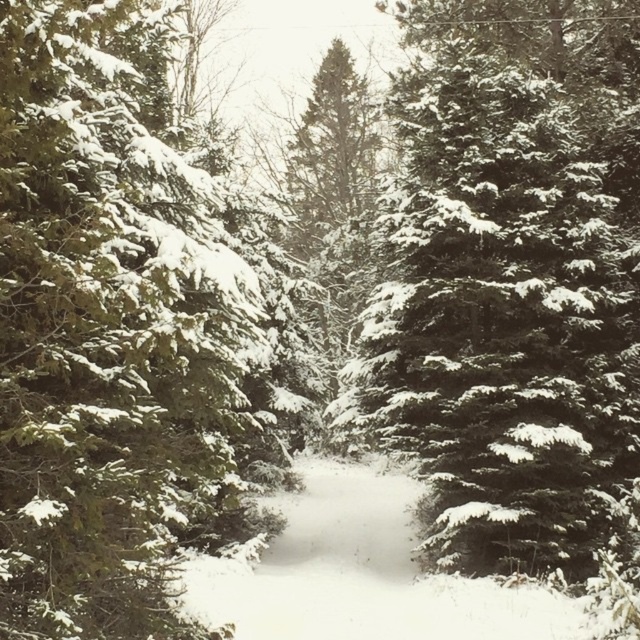
Question: Which of the following is the farthest from the observer?

Choices:
 (A) snow-covered evergreen at center
 (B) green matte evergreen tree at left

Answer: (A)

Question: Is green matte evergreen tree at left to the right of snow-covered evergreen at center from the viewer's perspective?

Choices:
 (A) yes
 (B) no

Answer: (B)

Question: Can you confirm if green matte evergreen tree at left is bigger than snow-covered evergreen at center?

Choices:
 (A) yes
 (B) no

Answer: (B)

Question: Does green matte evergreen tree at left have a larger size compared to snow-covered evergreen at center?

Choices:
 (A) no
 (B) yes

Answer: (A)

Question: Which point appears farthest from the camera in this image?

Choices:
 (A) (442, 196)
 (B) (99, 609)

Answer: (A)

Question: Among these points, which one is nearest to the camera?

Choices:
 (A) (172, 627)
 (B) (580, 304)

Answer: (A)